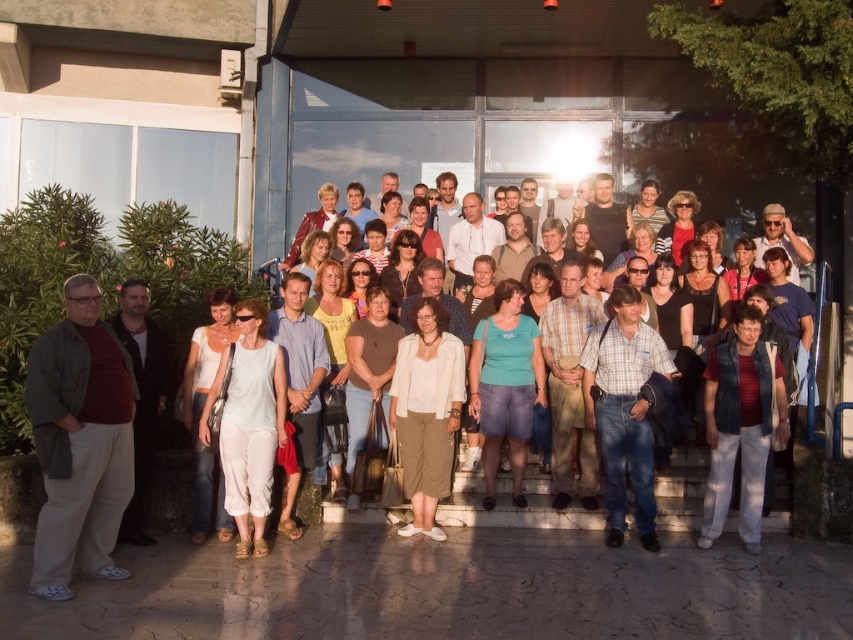
You are standing in front of the building with glass doors and windows. There is a point marked at coordinates (x=624, y=410). Which object in the scene is this point located on?

The point at coordinates (x=624, y=410) is located on the plaid shirt at center.

You are a photographer trying to adjust the lighting for a group photo. You notice two men in the center of the group wearing a plaid shirt at center and a white cotton shirt at center. Since the sunlight is creating glare on the building behind them, which of these two shirts might be more visible to the camera due to their position relative to the light source?

The white cotton shirt at center is behind the plaid shirt at center. Since it is positioned behind, it might be in shadow cast by the plaid shirt, making the plaid shirt at center more visible to the camera.